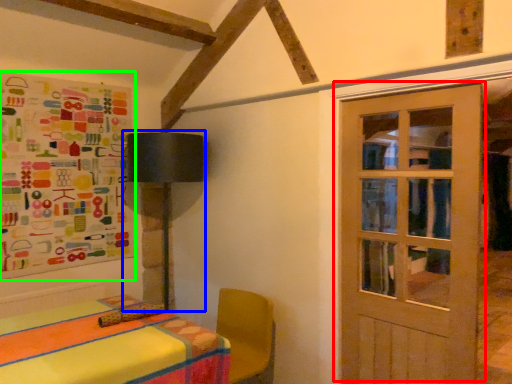
Question: Estimate the real-world distances between objects in this image. Which object is closer to door (highlighted by a red box), table lamp (highlighted by a blue box) or bulletin board (highlighted by a green box)?

Choices:
 (A) table lamp
 (B) bulletin board

Answer: (A)